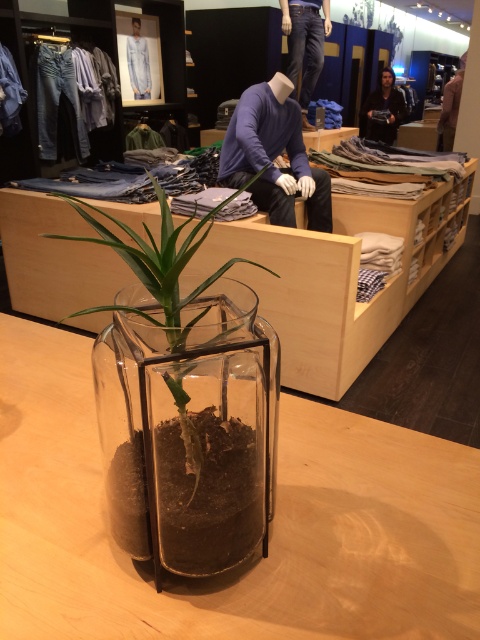
Can you confirm if transparent glass table at center is positioned to the right of purple matte sweater at center?

In fact, transparent glass table at center is to the left of purple matte sweater at center.

Does transparent glass table at center have a greater height compared to purple matte sweater at center?

In fact, transparent glass table at center may be shorter than purple matte sweater at center.

The width and height of the screenshot is (480, 640). What do you see at coordinates (272, 531) in the screenshot? I see `transparent glass table at center` at bounding box center [272, 531].

I want to click on transparent glass table at center, so click(272, 531).

Does transparent glass table at center come in front of black leather jacket at upper center?

That is True.

Is point (406, 618) in front of point (391, 76)?

Yes, point (406, 618) is in front of point (391, 76).

I want to click on transparent glass table at center, so click(272, 531).

Can you confirm if transparent glass vase at center is smaller than clear glass terrarium at center?

Correct, transparent glass vase at center occupies less space than clear glass terrarium at center.

Does transparent glass vase at center appear on the right side of clear glass terrarium at center?

Correct, you'll find transparent glass vase at center to the right of clear glass terrarium at center.

This screenshot has width=480, height=640. Describe the element at coordinates (189, 428) in the screenshot. I see `transparent glass vase at center` at that location.

You are a GUI agent. You are given a task and a screenshot of the screen. Output one action in this format:
    pyautogui.click(x=<x>, y=<y>)
    Task: Click on the transparent glass vase at center
    The width and height of the screenshot is (480, 640).
    Given the screenshot: What is the action you would take?
    [x=189, y=428]